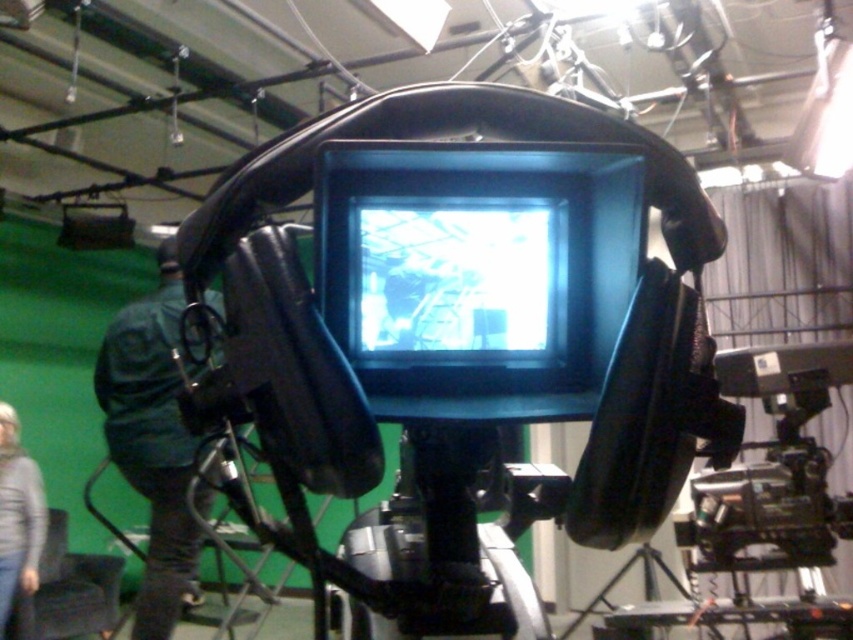
You are a technician who needs to place a protective cover over the black plastic video camera at lower right and the black plastic tripod at lower right. The cover you have can only fit items up to the size of the tripod. Will the cover fit over the camera?

The black plastic video camera at lower right is narrower than the black plastic tripod at lower right, so the cover designed for the tripod will fit over the camera as well.

You are an assistant helping set up the camera rig. The director wants to adjust the angle of the monitor to get a better view of the greenhouse scene. Since the black plastic screen at center is above the black plastic tripod at lower right, which object should you adjust to achieve this?

To adjust the angle of the monitor, you should adjust the black plastic tripod at lower right, as the black plastic screen at center is mounted above it and its position can be altered by adjusting the tripod.

You are a camera operator adjusting the monitor on the rig. You notice two points marked on the monitor screen at coordinates point (482, 154) and point (596, 595). Which point is nearer to your eyes as you look at the monitor?

Point (482, 154) is closer to the viewer than point (596, 595).